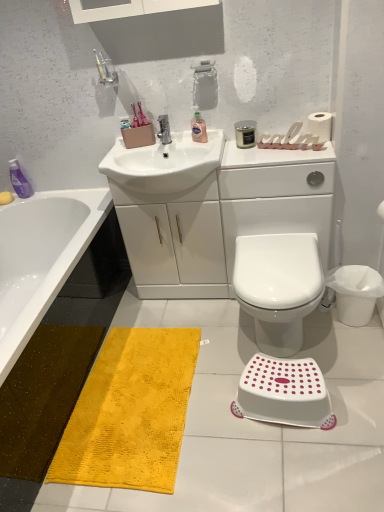
This screenshot has height=512, width=384. Identify the location of vacant point above white plastic step stool at lower right (from a real-world perspective). (283, 376).